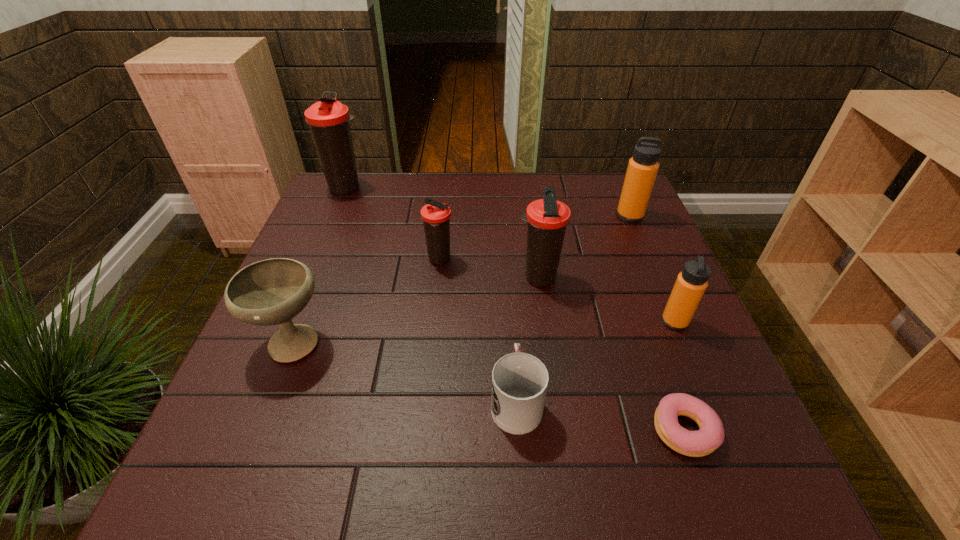
Where is `thermos bottle that is the fifth closest to the shortest object`? The image size is (960, 540). thermos bottle that is the fifth closest to the shortest object is located at coordinates (328, 119).

Locate which thermos bottle is the fifth closest to the seventh tallest object. Please provide its 2D coordinates. Your answer should be formatted as a tuple, i.e. [(x, y)], where the tuple contains the x and y coordinates of a point satisfying the conditions above.

[(328, 119)]

This screenshot has height=540, width=960. I want to click on the second closest brown thermos bottle to the red cup, so click(x=436, y=216).

Identify the location of brown thermos bottle that is the third closest to the red cup. This screenshot has height=540, width=960. (328, 119).

Identify the location of vacant region that satisfies the following two spatial constraints: 1. on the side of the third thermos bottle from right to left where the handle is located; 2. on the left side of the cup. (508, 278).

This screenshot has height=540, width=960. What are the coordinates of `free point that satisfies the following two spatial constraints: 1. on the side of the seventh tallest object where the handle is located; 2. on the left side of the fourth nearest thermos bottle` in the screenshot? It's located at (504, 215).

Identify the location of free location that satisfies the following two spatial constraints: 1. on the side of the rightmost brown thermos bottle where the handle is located; 2. on the right side of the second shortest object. The image size is (960, 540). (508, 278).

The width and height of the screenshot is (960, 540). What are the coordinates of `free location that satisfies the following two spatial constraints: 1. on the side of the second shortest object where the handle is located; 2. on the right side of the seventh nearest object` in the screenshot? It's located at (504, 215).